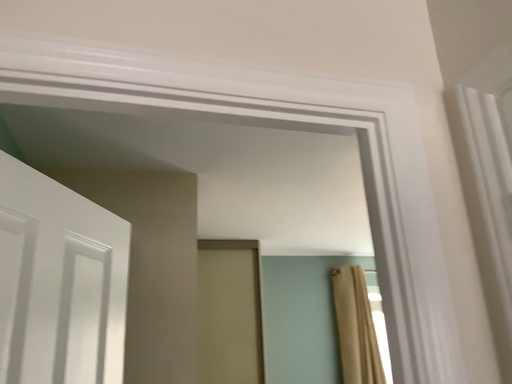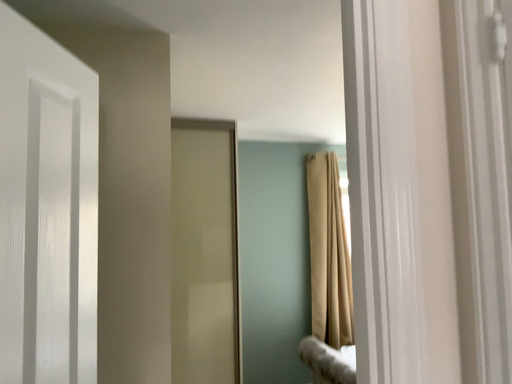
Question: How did the camera likely rotate when shooting the video?

Choices:
 (A) rotated downward
 (B) rotated upward

Answer: (A)